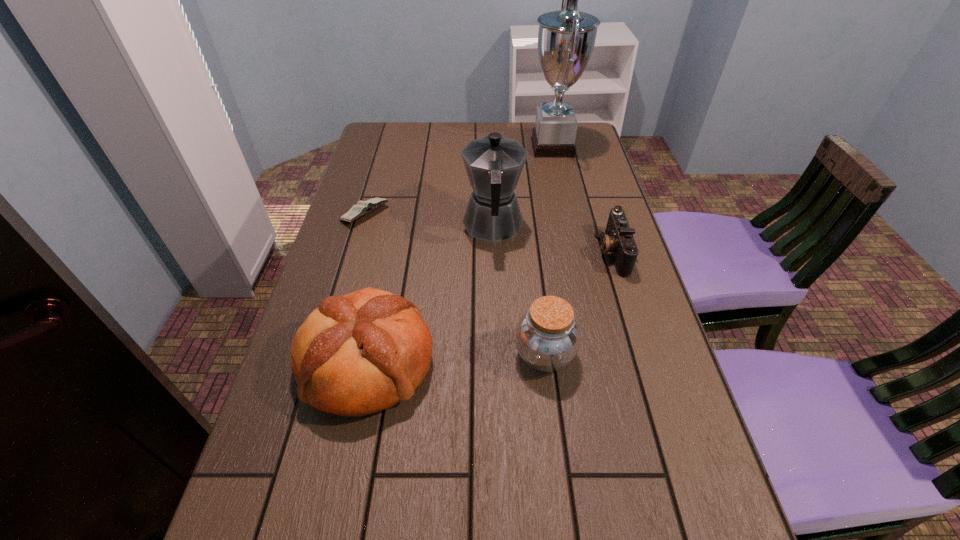
Find the location of a particular element. This screenshot has height=540, width=960. bread that is at the left edge is located at coordinates (364, 352).

Identify the location of diary that is at the left edge. 363,207.

The image size is (960, 540). I want to click on trophy cup present at the right edge, so click(566, 38).

You are a GUI agent. You are given a task and a screenshot of the screen. Output one action in this format:
    pyautogui.click(x=<x>, y=<y>)
    Task: Click on the camera located in the right edge section of the desktop
    This screenshot has height=540, width=960.
    Given the screenshot: What is the action you would take?
    pyautogui.click(x=618, y=239)

Locate an element on the screen. Image resolution: width=960 pixels, height=540 pixels. object present at the far right corner is located at coordinates (566, 38).

Where is `free space at the far edge of the desktop`? free space at the far edge of the desktop is located at coordinates (504, 124).

The image size is (960, 540). I want to click on free space at the left edge, so click(x=311, y=308).

The width and height of the screenshot is (960, 540). Find the location of `vacant space at the right edge of the desktop`. vacant space at the right edge of the desktop is located at coordinates (640, 293).

In the image, there is a desktop. What are the coordinates of `vacant space at the far left corner` in the screenshot? It's located at (410, 149).

Where is `vacant area that lies between the bread and the fifth shortest object`? This screenshot has height=540, width=960. vacant area that lies between the bread and the fifth shortest object is located at coordinates pyautogui.click(x=430, y=294).